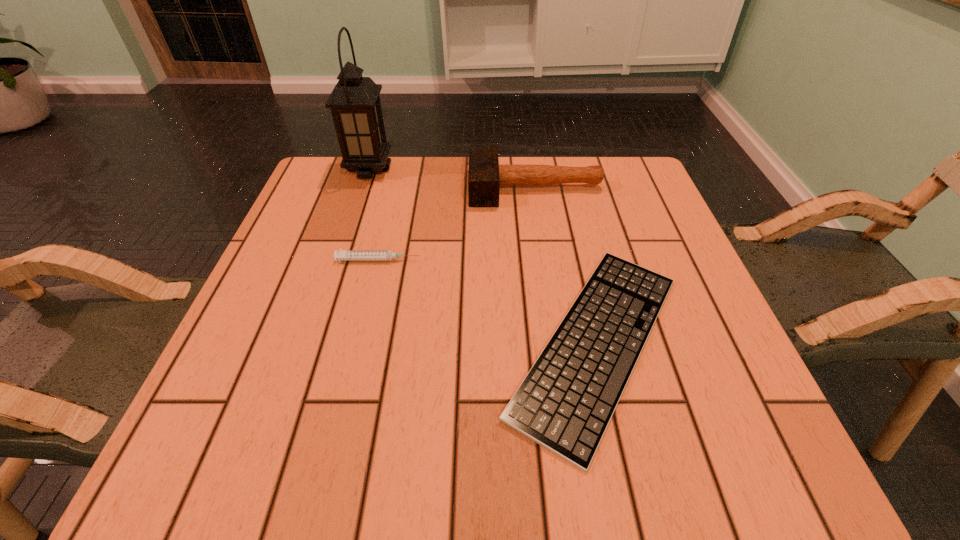
The height and width of the screenshot is (540, 960). Identify the location of free location at the far edge. (511, 188).

Where is `free space at the near edge`? free space at the near edge is located at coordinates (653, 423).

Find the location of a particular element. The height and width of the screenshot is (540, 960). vacant space at the left edge of the desktop is located at coordinates (316, 255).

The height and width of the screenshot is (540, 960). In the image, there is a desktop. In order to click on vacant space at the right edge in this screenshot , I will do `click(644, 212)`.

Identify the location of vacant area at the far left corner of the desktop. The height and width of the screenshot is (540, 960). (328, 166).

In the image, there is a desktop. Identify the location of vacant space at the near left corner. (239, 443).

Find the location of a particular element. The width and height of the screenshot is (960, 540). free space at the near right corner is located at coordinates (681, 471).

At what (x,y) coordinates should I click in order to perform the action: click on vacant area that lies between the second tallest object and the shortest object. Please return your answer as a coordinate pair (x, y). The height and width of the screenshot is (540, 960). Looking at the image, I should click on (566, 265).

Locate an element on the screen. The height and width of the screenshot is (540, 960). vacant area that lies between the mallet and the syringe is located at coordinates (457, 224).

Find the location of a particular element. blank region between the mallet and the lantern is located at coordinates (452, 178).